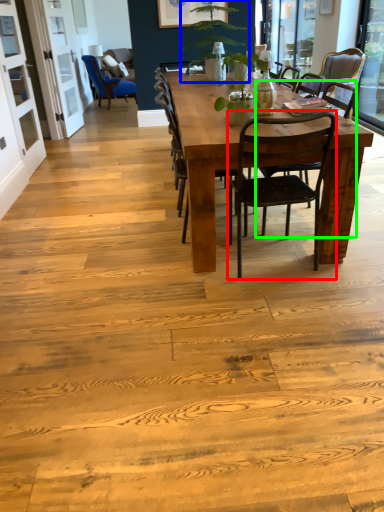
Question: Estimate the real-world distances between objects in this image. Which object is farther from chair (highlighted by a red box), houseplant (highlighted by a blue box) or chair (highlighted by a green box)?

Choices:
 (A) houseplant
 (B) chair

Answer: (A)